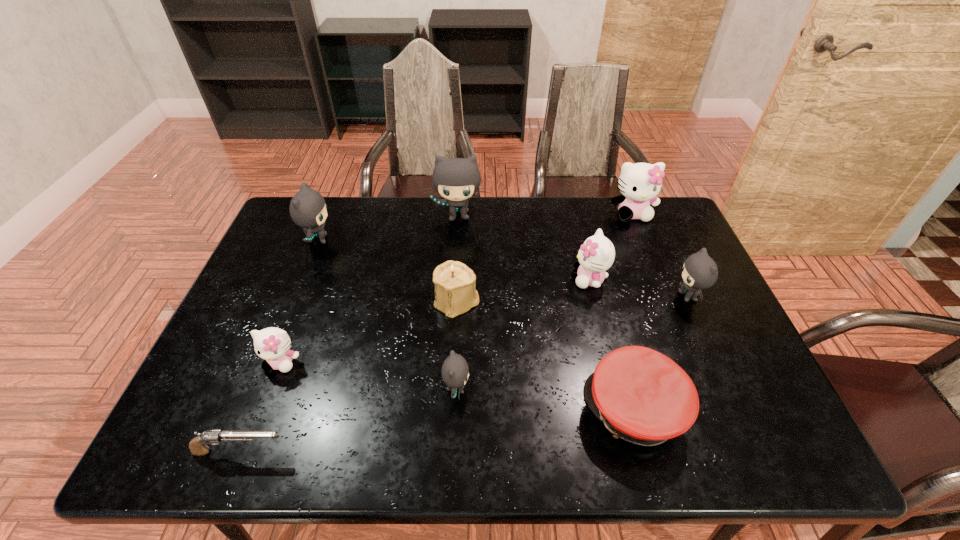
Find the location of a particular element. This screenshot has height=540, width=960. free space at the far left corner of the desktop is located at coordinates (286, 240).

I want to click on free space at the near left corner, so click(180, 446).

The width and height of the screenshot is (960, 540). What are the coordinates of `vacant region between the cap and the rightmost gray kitten` in the screenshot? It's located at (661, 353).

Image resolution: width=960 pixels, height=540 pixels. I want to click on free space between the red cap and the candle_holder, so click(x=545, y=356).

You are a GUI agent. You are given a task and a screenshot of the screen. Output one action in this format:
    pyautogui.click(x=<x>, y=<y>)
    Task: Click on the free space that is in between the smallest white kitten and the shortest object
    
    Given the screenshot: What is the action you would take?
    pyautogui.click(x=260, y=407)

Where is `vacant point located between the candle_holder and the rightmost white kitten`? The height and width of the screenshot is (540, 960). vacant point located between the candle_holder and the rightmost white kitten is located at coordinates (544, 258).

This screenshot has height=540, width=960. What are the coordinates of `vacant area that lies between the shortest object and the biggest gray kitten` in the screenshot? It's located at (349, 334).

The image size is (960, 540). Find the location of `free space between the gun and the smallest white kitten`. free space between the gun and the smallest white kitten is located at coordinates (260, 407).

Image resolution: width=960 pixels, height=540 pixels. Find the location of `vacant region between the leftmost white kitten and the second nearest gray kitten`. vacant region between the leftmost white kitten and the second nearest gray kitten is located at coordinates (485, 329).

Find the location of a particular element. The width and height of the screenshot is (960, 540). empty space that is in between the gun and the second white kitten from right to left is located at coordinates (415, 365).